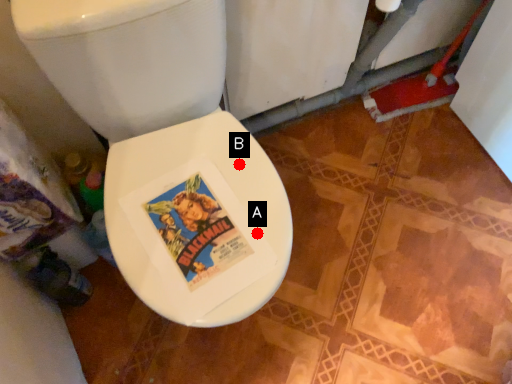
Question: Two points are circled on the image, labeled by A and B beside each circle. Which point is farther from the camera taking this photo?

Choices:
 (A) A is further
 (B) B is further

Answer: (B)